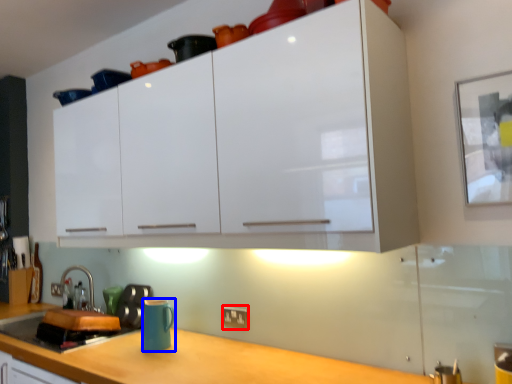
Question: Which object is further to the camera taking this photo, electric outlet (highlighted by a red box) or mug (highlighted by a blue box)?

Choices:
 (A) electric outlet
 (B) mug

Answer: (A)